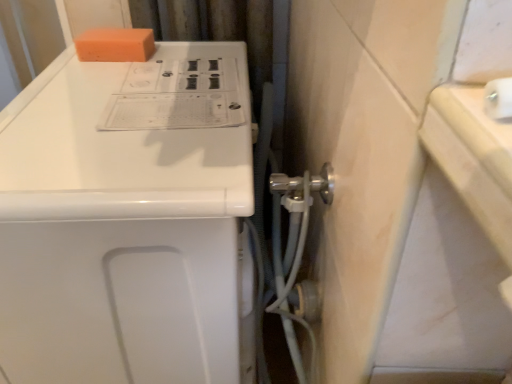
You are a GUI agent. You are given a task and a screenshot of the screen. Output one action in this format:
    pyautogui.click(x=<x>, y=<y>)
    Task: Click on the orange sponge at upper left
    This screenshot has height=384, width=512.
    Given the screenshot: What is the action you would take?
    pyautogui.click(x=115, y=45)

What do you see at coordinates (115, 45) in the screenshot? Image resolution: width=512 pixels, height=384 pixels. I see `orange sponge at upper left` at bounding box center [115, 45].

What is the approximate width of white glossy washing machine at upper left?

white glossy washing machine at upper left is 22.78 inches in width.

Identify the location of white glossy washing machine at upper left. The height and width of the screenshot is (384, 512). tap(125, 219).

This screenshot has height=384, width=512. What do you see at coordinates (125, 219) in the screenshot?
I see `white glossy washing machine at upper left` at bounding box center [125, 219].

In order to face white glossy washing machine at upper left, should I rotate leftwards or rightwards?

You should rotate left by 13.442 degrees.

At what (x,y) coordinates should I click in order to perform the action: click on orange sponge at upper left. Please return your answer as a coordinate pair (x, y). Image resolution: width=512 pixels, height=384 pixels. Looking at the image, I should click on (115, 45).

Based on the photo, which object is positioned more to the right, orange sponge at upper left or white glossy washing machine at upper left?

From the viewer's perspective, white glossy washing machine at upper left appears more on the right side.

Is orange sponge at upper left in front of or behind white glossy washing machine at upper left in the image?

Clearly, orange sponge at upper left is behind white glossy washing machine at upper left.

Does point (121, 34) come closer to viewer compared to point (226, 80)?

No, it is not.

From the image's perspective, which is below, orange sponge at upper left or white glossy washing machine at upper left?

white glossy washing machine at upper left appears lower in the image.

From a real-world perspective, relative to white glossy washing machine at upper left, is orange sponge at upper left vertically above or below?

orange sponge at upper left is above white glossy washing machine at upper left.

Considering the relative sizes of orange sponge at upper left and white glossy washing machine at upper left in the image provided, is orange sponge at upper left thinner than white glossy washing machine at upper left?

Correct, the width of orange sponge at upper left is less than that of white glossy washing machine at upper left.

Can you confirm if orange sponge at upper left is taller than white glossy washing machine at upper left?

No.

Which of these two, orange sponge at upper left or white glossy washing machine at upper left, is smaller?

Smaller between the two is orange sponge at upper left.

Is orange sponge at upper left not inside white glossy washing machine at upper left?

No.

Is orange sponge at upper left next to white glossy washing machine at upper left and touching it?

No, orange sponge at upper left is not beside white glossy washing machine at upper left.

Could you tell me if orange sponge at upper left is facing white glossy washing machine at upper left?

No.

How different are the orientations of orange sponge at upper left and white glossy washing machine at upper left in degrees?

4.29 degrees separate the facing orientations of orange sponge at upper left and white glossy washing machine at upper left.

Locate an element on the screen. soap behind the white glossy washing machine at upper left is located at coordinates (115, 45).

Based on their positions, is white glossy washing machine at upper left located to the left or right of orange sponge at upper left?

Clearly, white glossy washing machine at upper left is on the right of orange sponge at upper left in the image.

Between white glossy washing machine at upper left and orange sponge at upper left, which one is positioned behind?

Positioned behind is orange sponge at upper left.

Which is nearer, (68, 112) or (147, 46)?

Clearly, point (68, 112) is closer to the camera than point (147, 46).

From the image's perspective, which is below, white glossy washing machine at upper left or orange sponge at upper left?

white glossy washing machine at upper left.

From a real-world perspective, between white glossy washing machine at upper left and orange sponge at upper left, who is vertically higher?

orange sponge at upper left is physically above.

Can you confirm if white glossy washing machine at upper left is wider than orange sponge at upper left?

Indeed, white glossy washing machine at upper left has a greater width compared to orange sponge at upper left.

In the scene shown: Considering the relative sizes of white glossy washing machine at upper left and orange sponge at upper left in the image provided, is white glossy washing machine at upper left taller than orange sponge at upper left?

Indeed, white glossy washing machine at upper left has a greater height compared to orange sponge at upper left.

Considering the relative sizes of white glossy washing machine at upper left and orange sponge at upper left in the image provided, is white glossy washing machine at upper left bigger than orange sponge at upper left?

Yes, white glossy washing machine at upper left is bigger than orange sponge at upper left.

Is white glossy washing machine at upper left not inside orange sponge at upper left?

That's correct, white glossy washing machine at upper left is outside of orange sponge at upper left.

Is white glossy washing machine at upper left positioned far away from orange sponge at upper left?

That's not correct — white glossy washing machine at upper left is a little close to orange sponge at upper left.

Is white glossy washing machine at upper left oriented towards orange sponge at upper left?

No, white glossy washing machine at upper left is not oriented towards orange sponge at upper left.

How many degrees apart are the facing directions of white glossy washing machine at upper left and orange sponge at upper left?

The angular difference between white glossy washing machine at upper left and orange sponge at upper left is 4.29 degrees.

You are a GUI agent. You are given a task and a screenshot of the screen. Output one action in this format:
    pyautogui.click(x=<x>, y=<y>)
    Task: Click on the soap that appears behind the white glossy washing machine at upper left
    This screenshot has width=512, height=384.
    Given the screenshot: What is the action you would take?
    pyautogui.click(x=115, y=45)

The height and width of the screenshot is (384, 512). I want to click on home appliance in front of the orange sponge at upper left, so click(x=125, y=219).

Image resolution: width=512 pixels, height=384 pixels. I want to click on soap on the left of white glossy washing machine at upper left, so click(115, 45).